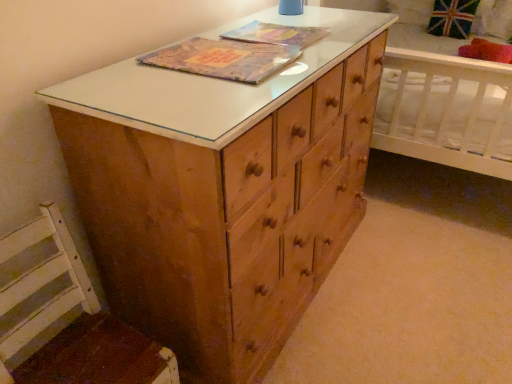
Question: Which direction should I rotate to look at matte plastic book at center, which appears as the 1th book cover when viewed from the back?

Choices:
 (A) right
 (B) left

Answer: (A)

Question: Can you confirm if matte plastic book at center, the 2th book cover when ordered from front to back, is positioned to the left of textured paper book at center, the second book cover in the back-to-front sequence?

Choices:
 (A) no
 (B) yes

Answer: (A)

Question: From a real-world perspective, is matte plastic book at center, which appears as the 1th book cover when viewed from the back, positioned over textured paper book at center, which appears as the first book cover when viewed from the front, based on gravity?

Choices:
 (A) no
 (B) yes

Answer: (A)

Question: Would you say matte plastic book at center, the 2th book cover when ordered from front to back, contains textured paper book at center, the second book cover in the back-to-front sequence?

Choices:
 (A) yes
 (B) no

Answer: (B)

Question: Can you confirm if matte plastic book at center, the 2th book cover when ordered from front to back, is thinner than textured paper book at center, which appears as the first book cover when viewed from the front?

Choices:
 (A) no
 (B) yes

Answer: (B)

Question: Does matte plastic book at center, the 2th book cover when ordered from front to back, have a greater width compared to textured paper book at center, which appears as the first book cover when viewed from the front?

Choices:
 (A) no
 (B) yes

Answer: (A)

Question: Is the position of matte plastic book at center, the 2th book cover when ordered from front to back, less distant than that of textured paper book at center, the second book cover in the back-to-front sequence?

Choices:
 (A) no
 (B) yes

Answer: (A)

Question: Considering the relative sizes of textured paper book at center, the second book cover in the back-to-front sequence, and red plush pillow at upper right in the image provided, is textured paper book at center, the second book cover in the back-to-front sequence, shorter than red plush pillow at upper right?

Choices:
 (A) yes
 (B) no

Answer: (A)

Question: Is textured paper book at center, which appears as the first book cover when viewed from the front, to the right of red plush pillow at upper right from the viewer's perspective?

Choices:
 (A) yes
 (B) no

Answer: (B)

Question: Is red plush pillow at upper right completely or partially inside textured paper book at center, which appears as the first book cover when viewed from the front?

Choices:
 (A) no
 (B) yes

Answer: (A)

Question: From a real-world perspective, does textured paper book at center, which appears as the first book cover when viewed from the front, stand above red plush pillow at upper right?

Choices:
 (A) yes
 (B) no

Answer: (A)

Question: Does textured paper book at center, which appears as the first book cover when viewed from the front, have a lesser width compared to red plush pillow at upper right?

Choices:
 (A) yes
 (B) no

Answer: (A)

Question: Does textured paper book at center, which appears as the first book cover when viewed from the front, have a greater width compared to red plush pillow at upper right?

Choices:
 (A) yes
 (B) no

Answer: (B)

Question: From a real-world perspective, does matte plastic book at center, which appears as the 1th book cover when viewed from the back, sit lower than red plush pillow at upper right?

Choices:
 (A) no
 (B) yes

Answer: (A)